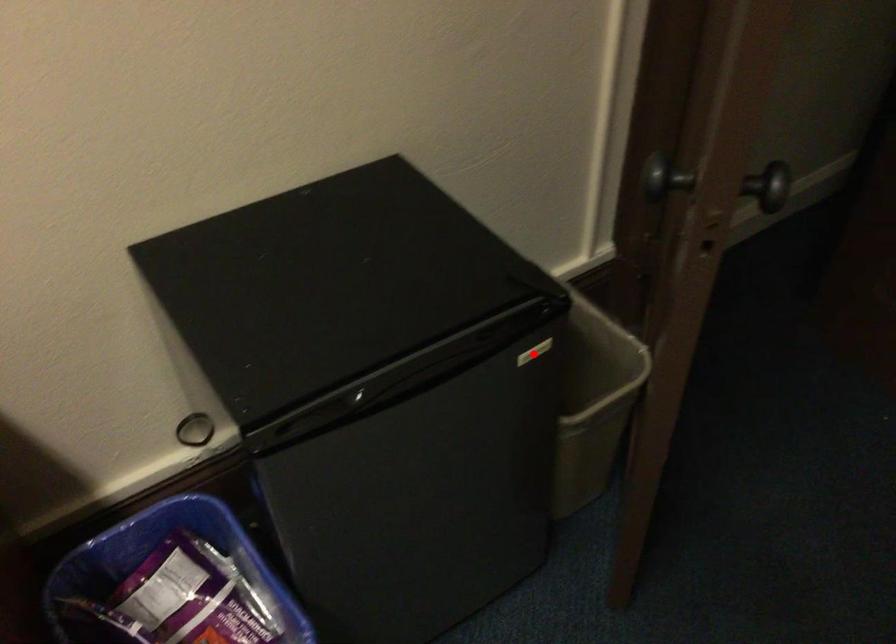
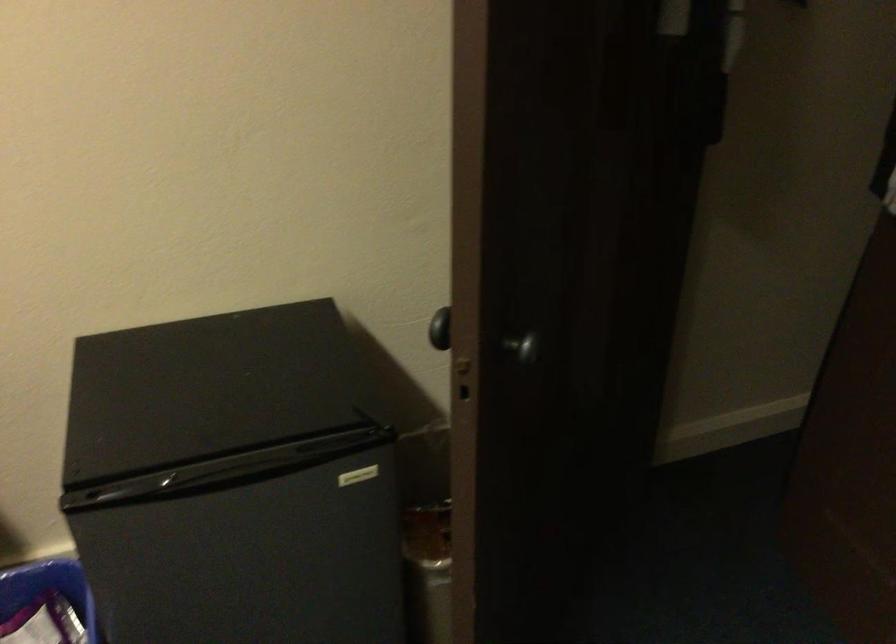
The point at the highlighted location is marked in the first image. Where is the corresponding point in the second image?

(358, 476)